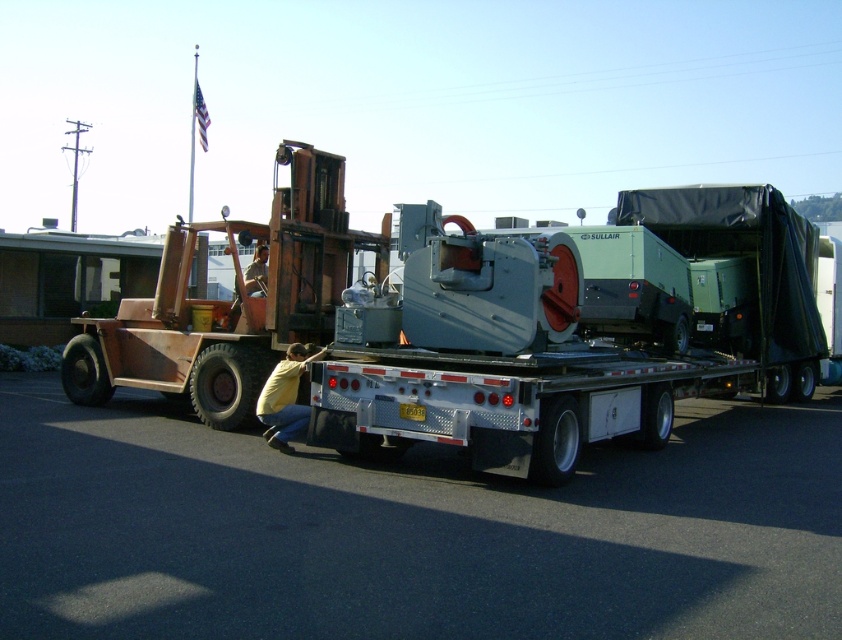
You are a delivery driver who needs to unload the metallic gray machinery at center from the flatbed truck. The truck is parked on the black asphalt at lower center. If your forklift has a maximum reach of 7 feet, can you safely unload the machinery without moving the truck?

The distance between the black asphalt at lower center and the metallic gray machinery at center is 7.82 feet, which exceeds the forklifts 7 foot reach. Therefore, the forklift cannot safely reach the machinery without moving the truck.

You are a delivery driver who needs to unload the metallic gray machinery at center from the flatbed truck. The truck bed is at the same level as the black asphalt at lower center. Can you safely drive the truck forward to let the machinery slide off onto the asphalt?

The black asphalt at lower center has a lesser height compared to metallic gray machinery at center, so driving the truck forward might not allow the machinery to slide off safely as the asphalt is lower. You should use a ramp or lifting equipment to ensure safe unloading.

You are a delivery driver who just arrived at the industrial site and see the rusty metal forklift at center and the yellow shirt at lower center. Which object is closer to you?

The rusty metal forklift at center is closer to you because it is further to the viewer than the yellow shirt at lower center, meaning it appears nearer in the scene.